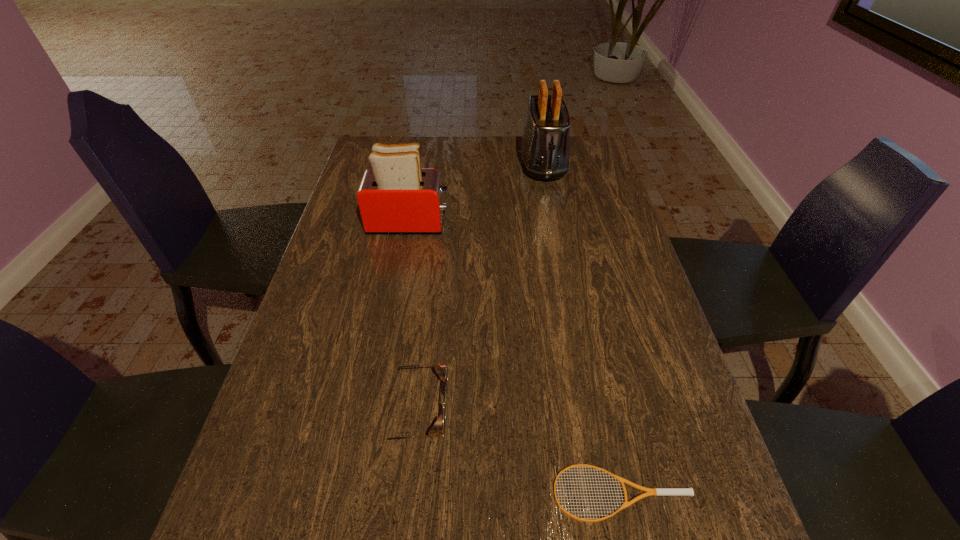
The image size is (960, 540). In order to click on vacant space that's between the sunglasses and the farthest object in this screenshot , I will do `click(478, 287)`.

This screenshot has height=540, width=960. I want to click on object that is the closest to the nearer toaster, so click(x=545, y=146).

Select which object is the third closest to the second shortest object. Please provide its 2D coordinates. Your answer should be formatted as a tuple, i.e. [(x, y)], where the tuple contains the x and y coordinates of a point satisfying the conditions above.

[(545, 146)]

This screenshot has width=960, height=540. Identify the location of free region that satisfies the following two spatial constraints: 1. on the side of the farther toaster with the control lever; 2. on the front-facing side of the nearer toaster. (555, 223).

Image resolution: width=960 pixels, height=540 pixels. Find the location of `free space that satisfies the following two spatial constraints: 1. on the front-facing side of the shortest object; 2. on the right side of the nearer toaster`. free space that satisfies the following two spatial constraints: 1. on the front-facing side of the shortest object; 2. on the right side of the nearer toaster is located at coordinates (359, 493).

Identify the location of vacant position in the image that satisfies the following two spatial constraints: 1. on the side of the right toaster with the control lever; 2. on the front-facing side of the nearer toaster. (555, 223).

Where is `vacant space that satisfies the following two spatial constraints: 1. on the front-facing side of the second farthest object; 2. on the right side of the nearest object`? The image size is (960, 540). vacant space that satisfies the following two spatial constraints: 1. on the front-facing side of the second farthest object; 2. on the right side of the nearest object is located at coordinates pos(359,493).

Locate an element on the screen. The image size is (960, 540). vacant space that satisfies the following two spatial constraints: 1. on the side of the farthest object with the control lever; 2. on the front-facing side of the left toaster is located at coordinates (555, 223).

Where is `vacant position in the image that satisfies the following two spatial constraints: 1. on the side of the right toaster with the control lever; 2. on the front-facing side of the third nearest object`? vacant position in the image that satisfies the following two spatial constraints: 1. on the side of the right toaster with the control lever; 2. on the front-facing side of the third nearest object is located at coordinates (555, 223).

Locate an element on the screen. The image size is (960, 540). free location that satisfies the following two spatial constraints: 1. on the side of the farther toaster with the control lever; 2. on the front-facing side of the left toaster is located at coordinates point(555,223).